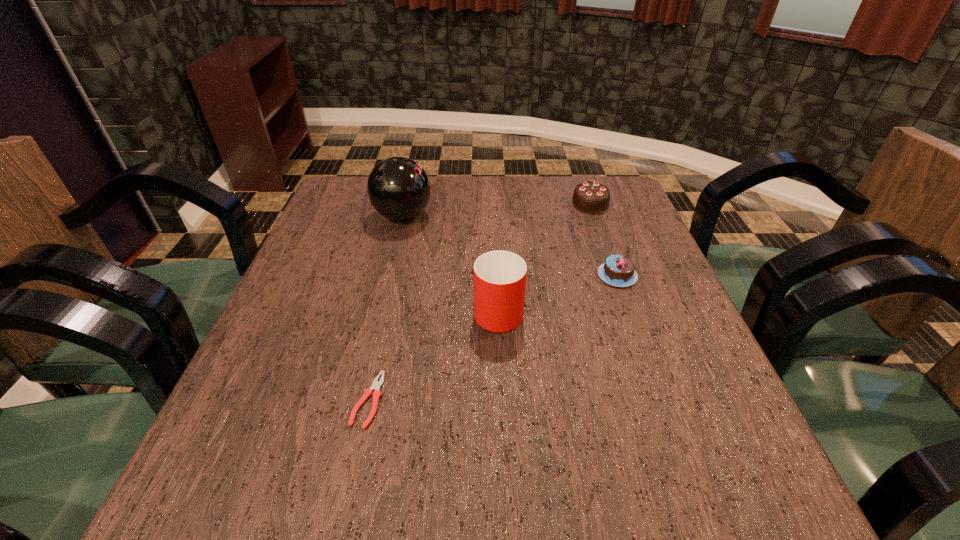
In order to click on free area in between the second tallest object and the nearer chocolate cake in this screenshot , I will do `click(558, 292)`.

Where is `vacant area that lies between the pliers and the fourth shortest object`? This screenshot has height=540, width=960. vacant area that lies between the pliers and the fourth shortest object is located at coordinates (433, 354).

Where is `free spot between the nearer chocolate cake and the shortest object`? free spot between the nearer chocolate cake and the shortest object is located at coordinates (492, 338).

Find the location of a particular element. Image resolution: width=960 pixels, height=540 pixels. free area in between the third tallest object and the nearer chocolate cake is located at coordinates (604, 240).

Identify the location of free space between the pliers and the bowling ball. (386, 308).

The image size is (960, 540). Find the location of `vacant area that lies between the nearer chocolate cake and the taller chocolate cake`. vacant area that lies between the nearer chocolate cake and the taller chocolate cake is located at coordinates 604,240.

Select which object appears as the third closest to the shortest object. Please provide its 2D coordinates. Your answer should be formatted as a tuple, i.e. [(x, y)], where the tuple contains the x and y coordinates of a point satisfying the conditions above.

[(619, 271)]

Where is `object that stands as the third closest to the pliers`? The width and height of the screenshot is (960, 540). object that stands as the third closest to the pliers is located at coordinates (619, 271).

Where is `free space that satisfies the following two spatial constraints: 1. on the side of the cup with the handle; 2. on the surface of the tallest object near the finger holes`? free space that satisfies the following two spatial constraints: 1. on the side of the cup with the handle; 2. on the surface of the tallest object near the finger holes is located at coordinates (494, 215).

Identify the location of vacant position in the image that satisfies the following two spatial constraints: 1. on the surface of the tallest object near the finger holes; 2. on the back side of the fourth tallest object. (389, 275).